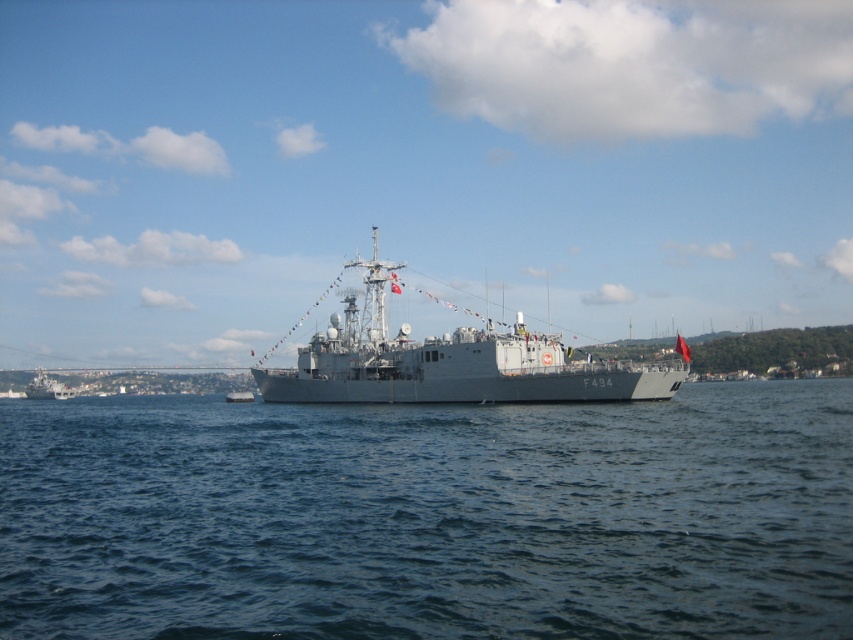
You are standing on the deck of the naval ship F494 and want to reach the point marked at coordinate (624, 374) on the ship. If your maximum reach is 160 feet, can you comfortably extend your arm to touch that point without moving your feet?

The point at coordinate (624, 374) is 168.53 feet away from the viewer. Since your maximum reach is 160 feet, you cannot comfortably extend your arm to touch that point without moving your feet.

You are an observer on the naval ship F494. You want to locate the blue water at center. Where should you look in terms of coordinates?

The blue water at center is located at coordinates point [430,516].

Based on the scene description, where exactly is the blue water at center located in the image?

The blue water at center is located at point (430, 516).